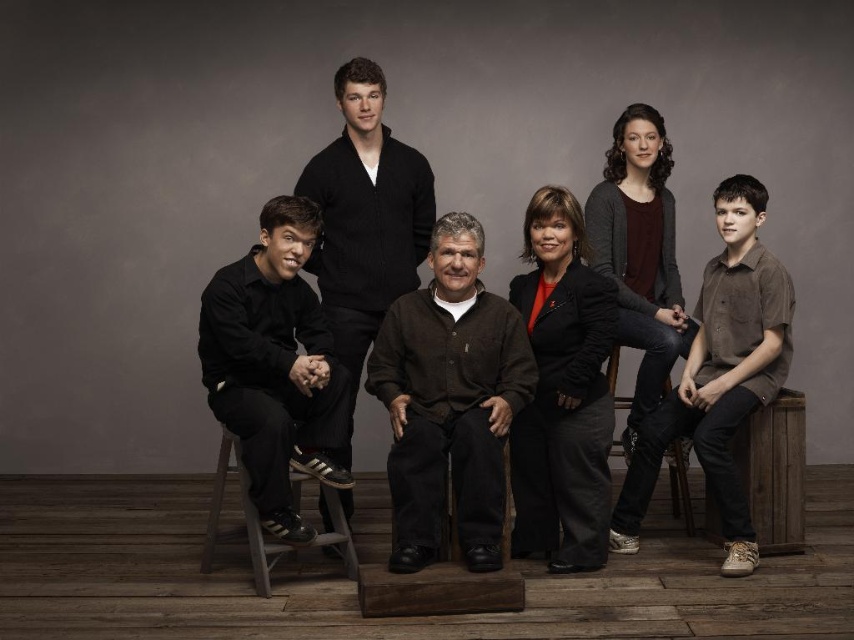
Measure the distance from matte black jacket at center to wooden chair at lower right.

matte black jacket at center and wooden chair at lower right are 4.33 feet apart from each other.

In the scene shown: Does matte black jacket at center appear on the left side of wooden chair at lower right?

Indeed, matte black jacket at center is positioned on the left side of wooden chair at lower right.

Does point (366, 100) come farther from viewer compared to point (679, 460)?

No.

You are a GUI agent. You are given a task and a screenshot of the screen. Output one action in this format:
    pyautogui.click(x=<x>, y=<y>)
    Task: Click on the matte black jacket at center
    The width and height of the screenshot is (854, 640).
    Given the screenshot: What is the action you would take?
    pyautogui.click(x=267, y=355)

Does wooden stool at lower left appear under wooden chair at lower right?

Yes.

Looking at this image, which is more to the left, wooden stool at lower left or wooden chair at lower right?

Positioned to the left is wooden stool at lower left.

This screenshot has width=854, height=640. Describe the element at coordinates (244, 518) in the screenshot. I see `wooden stool at lower left` at that location.

Where is `wooden stool at lower left`? This screenshot has width=854, height=640. wooden stool at lower left is located at coordinates (244, 518).

Does matte black jacket at center come behind black matte shirt at left?

Yes, it is.

Is point (344, 348) more distant than point (291, 276)?

Yes.

The width and height of the screenshot is (854, 640). I want to click on matte black jacket at center, so click(267, 355).

Image resolution: width=854 pixels, height=640 pixels. Identify the location of matte black jacket at center. (267, 355).